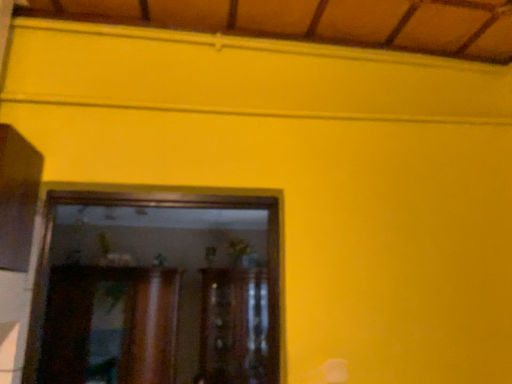
What do you see at coordinates (122, 322) in the screenshot?
I see `wooden cabinet at center, which is counted as the 1th cabinetry, starting from the left` at bounding box center [122, 322].

Where is `wooden cabinet at center, which is counted as the 1th cabinetry, starting from the left`? This screenshot has width=512, height=384. wooden cabinet at center, which is counted as the 1th cabinetry, starting from the left is located at coordinates (122, 322).

Image resolution: width=512 pixels, height=384 pixels. Describe the element at coordinates (234, 326) in the screenshot. I see `wooden cabinet at center, acting as the 1th cabinetry starting from the right` at that location.

At what (x,y) coordinates should I click in order to perform the action: click on wooden cabinet at center, acting as the 1th cabinetry starting from the right. Please return your answer as a coordinate pair (x, y). The width and height of the screenshot is (512, 384). Looking at the image, I should click on (234, 326).

Measure the distance between wooden cabinet at center, acting as the 1th cabinetry starting from the right, and camera.

wooden cabinet at center, acting as the 1th cabinetry starting from the right, is 2.98 meters from camera.

Locate an element on the screen. wooden cabinet at center, which is counted as the 1th cabinetry, starting from the left is located at coordinates (122, 322).

Looking at this image, considering the positions of objects wooden cabinet at center, arranged as the 2th cabinetry when viewed from the left, and wooden cabinet at center, which appears as the 2th cabinetry when viewed from the right, in the image provided, who is more to the right, wooden cabinet at center, arranged as the 2th cabinetry when viewed from the left, or wooden cabinet at center, which appears as the 2th cabinetry when viewed from the right,?

wooden cabinet at center, arranged as the 2th cabinetry when viewed from the left.

Is wooden cabinet at center, arranged as the 2th cabinetry when viewed from the left, in front of or behind wooden cabinet at center, which appears as the 2th cabinetry when viewed from the right, in the image?

Clearly, wooden cabinet at center, arranged as the 2th cabinetry when viewed from the left, is behind wooden cabinet at center, which appears as the 2th cabinetry when viewed from the right.

Considering the positions of point (232, 316) and point (52, 306), is point (232, 316) closer or farther from the camera than point (52, 306)?

Point (232, 316) appears to be farther away from the viewer than point (52, 306).

In the scene shown: From the image's perspective, does wooden cabinet at center, acting as the 1th cabinetry starting from the right, appear higher than wooden cabinet at center, which appears as the 2th cabinetry when viewed from the right?

No, from the image's perspective, wooden cabinet at center, acting as the 1th cabinetry starting from the right, is not above wooden cabinet at center, which appears as the 2th cabinetry when viewed from the right.

From a real-world perspective, is wooden cabinet at center, acting as the 1th cabinetry starting from the right, physically above wooden cabinet at center, which appears as the 2th cabinetry when viewed from the right?

No, from a real-world perspective, wooden cabinet at center, acting as the 1th cabinetry starting from the right, is not above wooden cabinet at center, which appears as the 2th cabinetry when viewed from the right.

Which of these two, wooden cabinet at center, arranged as the 2th cabinetry when viewed from the left, or wooden cabinet at center, which appears as the 2th cabinetry when viewed from the right, is thinner?

Thinner between the two is wooden cabinet at center, which appears as the 2th cabinetry when viewed from the right.

Can you confirm if wooden cabinet at center, acting as the 1th cabinetry starting from the right, is taller than wooden cabinet at center, which appears as the 2th cabinetry when viewed from the right?

Indeed, wooden cabinet at center, acting as the 1th cabinetry starting from the right, has a greater height compared to wooden cabinet at center, which appears as the 2th cabinetry when viewed from the right.

Considering the relative sizes of wooden cabinet at center, acting as the 1th cabinetry starting from the right, and wooden cabinet at center, which is counted as the 1th cabinetry, starting from the left, in the image provided, is wooden cabinet at center, acting as the 1th cabinetry starting from the right, smaller than wooden cabinet at center, which is counted as the 1th cabinetry, starting from the left,?

No.

Could wooden cabinet at center, which is counted as the 1th cabinetry, starting from the left, be considered to be inside wooden cabinet at center, acting as the 1th cabinetry starting from the right?

No.

Are wooden cabinet at center, arranged as the 2th cabinetry when viewed from the left, and wooden cabinet at center, which appears as the 2th cabinetry when viewed from the right, far apart?

Actually, wooden cabinet at center, arranged as the 2th cabinetry when viewed from the left, and wooden cabinet at center, which appears as the 2th cabinetry when viewed from the right, are a little close together.

Is wooden cabinet at center, acting as the 1th cabinetry starting from the right, positioned with its back to wooden cabinet at center, which is counted as the 1th cabinetry, starting from the left?

wooden cabinet at center, acting as the 1th cabinetry starting from the right, does not have its back to wooden cabinet at center, which is counted as the 1th cabinetry, starting from the left.

Can you tell me how much wooden cabinet at center, acting as the 1th cabinetry starting from the right, and wooden cabinet at center, which appears as the 2th cabinetry when viewed from the right, differ in facing direction?

The angular difference between wooden cabinet at center, acting as the 1th cabinetry starting from the right, and wooden cabinet at center, which appears as the 2th cabinetry when viewed from the right, is 0.000317 degrees.

This screenshot has width=512, height=384. In the image, there is a wooden cabinet at center, which appears as the 2th cabinetry when viewed from the right. Find the location of `cabinetry below it (from the image's perspective)`. cabinetry below it (from the image's perspective) is located at coordinates (234, 326).

Is wooden cabinet at center, which is counted as the 1th cabinetry, starting from the left, to the left or to the right of wooden cabinet at center, arranged as the 2th cabinetry when viewed from the left, in the image?

In the image, wooden cabinet at center, which is counted as the 1th cabinetry, starting from the left, appears on the left side of wooden cabinet at center, arranged as the 2th cabinetry when viewed from the left.

Is wooden cabinet at center, which is counted as the 1th cabinetry, starting from the left, further to camera compared to wooden cabinet at center, arranged as the 2th cabinetry when viewed from the left?

No, wooden cabinet at center, which is counted as the 1th cabinetry, starting from the left, is in front of wooden cabinet at center, arranged as the 2th cabinetry when viewed from the left.

Does point (140, 280) come farther from viewer compared to point (251, 329)?

No, (140, 280) is in front of (251, 329).

From the image's perspective, which is above, wooden cabinet at center, which appears as the 2th cabinetry when viewed from the right, or wooden cabinet at center, arranged as the 2th cabinetry when viewed from the left?

wooden cabinet at center, which appears as the 2th cabinetry when viewed from the right, is shown above in the image.

Consider the image. From a real-world perspective, is wooden cabinet at center, which appears as the 2th cabinetry when viewed from the right, above or below wooden cabinet at center, acting as the 1th cabinetry starting from the right?

Clearly, from a real-world perspective, wooden cabinet at center, which appears as the 2th cabinetry when viewed from the right, is above wooden cabinet at center, acting as the 1th cabinetry starting from the right.

Is wooden cabinet at center, which is counted as the 1th cabinetry, starting from the left, wider than wooden cabinet at center, acting as the 1th cabinetry starting from the right?

In fact, wooden cabinet at center, which is counted as the 1th cabinetry, starting from the left, might be narrower than wooden cabinet at center, acting as the 1th cabinetry starting from the right.

In terms of height, does wooden cabinet at center, which appears as the 2th cabinetry when viewed from the right, look taller or shorter compared to wooden cabinet at center, arranged as the 2th cabinetry when viewed from the left?

Clearly, wooden cabinet at center, which appears as the 2th cabinetry when viewed from the right, is shorter compared to wooden cabinet at center, arranged as the 2th cabinetry when viewed from the left.

Is wooden cabinet at center, which is counted as the 1th cabinetry, starting from the left, bigger than wooden cabinet at center, acting as the 1th cabinetry starting from the right?

Answer: No, wooden cabinet at center, which is counted as the 1th cabinetry, starting from the left, is not bigger than wooden cabinet at center, acting as the 1th cabinetry starting from the right.

Is wooden cabinet at center, which appears as the 2th cabinetry when viewed from the right, inside or outside of wooden cabinet at center, acting as the 1th cabinetry starting from the right?

The correct answer is: outside.

Is there a large distance between wooden cabinet at center, which is counted as the 1th cabinetry, starting from the left, and wooden cabinet at center, arranged as the 2th cabinetry when viewed from the left?

They are positioned close to each other.

Does wooden cabinet at center, which is counted as the 1th cabinetry, starting from the left, turn towards wooden cabinet at center, acting as the 1th cabinetry starting from the right?

No, wooden cabinet at center, which is counted as the 1th cabinetry, starting from the left, is not aimed at wooden cabinet at center, acting as the 1th cabinetry starting from the right.

Can you tell me how much wooden cabinet at center, which appears as the 2th cabinetry when viewed from the right, and wooden cabinet at center, arranged as the 2th cabinetry when viewed from the left, differ in facing direction?

0.000317 degrees.

Could you measure the distance between wooden cabinet at center, which appears as the 2th cabinetry when viewed from the right, and wooden cabinet at center, arranged as the 2th cabinetry when viewed from the left?

They are 56.61 centimeters apart.

The height and width of the screenshot is (384, 512). Find the location of `cabinetry below the wooden cabinet at center, which appears as the 2th cabinetry when viewed from the right (from a real-world perspective)`. cabinetry below the wooden cabinet at center, which appears as the 2th cabinetry when viewed from the right (from a real-world perspective) is located at coordinates (234, 326).

The height and width of the screenshot is (384, 512). What are the coordinates of `cabinetry that appears behind the wooden cabinet at center, which is counted as the 1th cabinetry, starting from the left` in the screenshot? It's located at (234, 326).

Locate an element on the screen. The image size is (512, 384). cabinetry in front of the wooden cabinet at center, acting as the 1th cabinetry starting from the right is located at coordinates (122, 322).